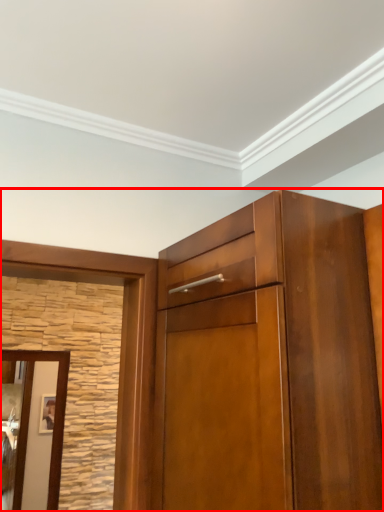
Question: From the image's perspective, where is cupboard (annotated by the red box) located in relation to door in the image?

Choices:
 (A) above
 (B) below

Answer: (A)